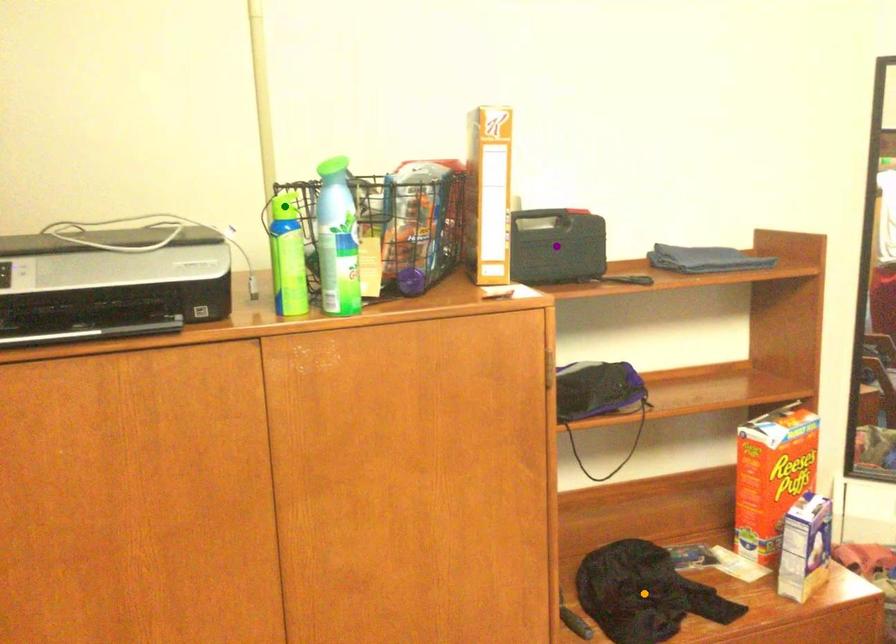
Order these from nearest to farthest:
- orange point
- green point
- purple point

green point, orange point, purple point